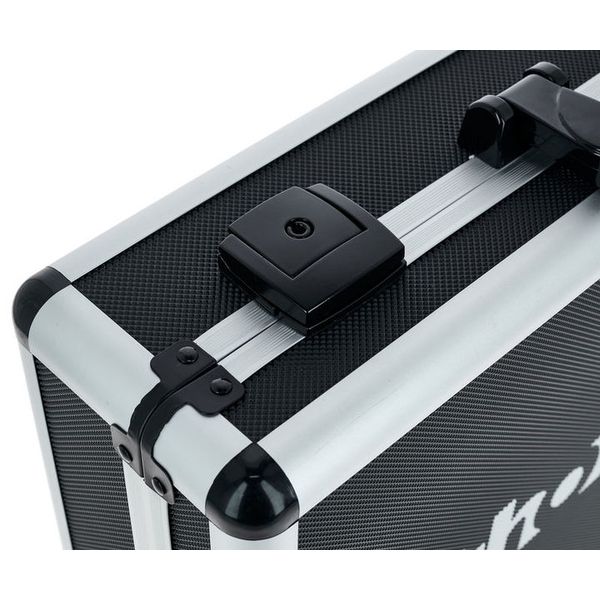
Locate an element on the screen. This screenshot has width=600, height=600. box corner is located at coordinates (257, 492), (30, 291).